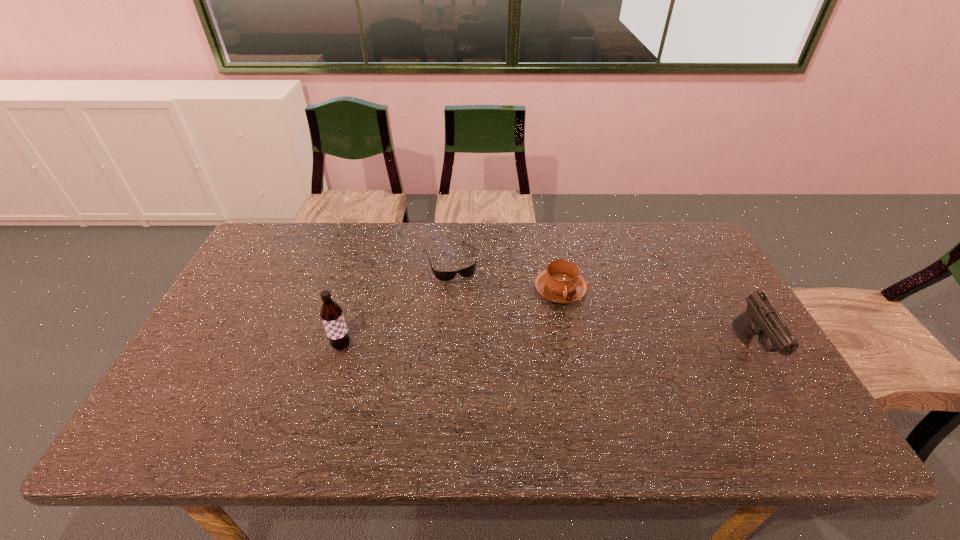
Locate an element on the screen. The image size is (960, 540). free space between the second tallest object and the cappuccino is located at coordinates (656, 320).

The height and width of the screenshot is (540, 960). Identify the location of free space that is in between the rightmost object and the leftmost object. (546, 348).

Locate an element on the screen. This screenshot has height=540, width=960. empty location between the third object from right to left and the cappuccino is located at coordinates (505, 275).

Locate an element on the screen. unoccupied position between the rightmost object and the tallest object is located at coordinates (546, 348).

You are a GUI agent. You are given a task and a screenshot of the screen. Output one action in this format:
    pyautogui.click(x=<x>, y=<y>)
    Task: Click on the vacant area between the cappuccino and the tallest object
    The image size is (960, 540).
    Given the screenshot: What is the action you would take?
    pyautogui.click(x=451, y=318)

Identify the location of unoccupied position between the second object from right to left and the tallest object. The image size is (960, 540). (451, 318).

The image size is (960, 540). I want to click on the second closest object to the second object from left to right, so click(331, 313).

This screenshot has width=960, height=540. What are the coordinates of `object that is the closest to the rightmost object` in the screenshot? It's located at (561, 282).

This screenshot has height=540, width=960. I want to click on vacant space that satisfies the following two spatial constraints: 1. on the back side of the third object from right to left; 2. on the left side of the tallest object, so click(367, 261).